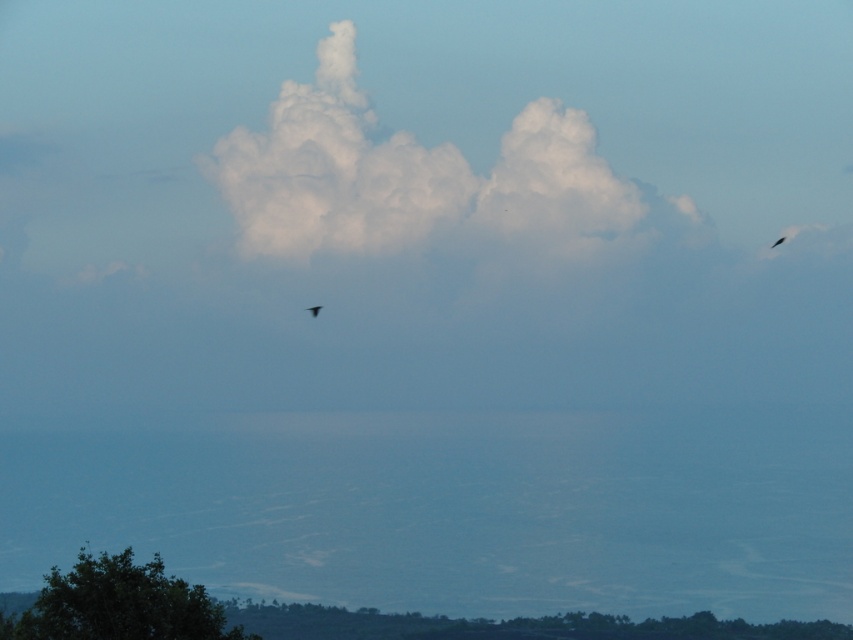
Question: Which object is the farthest from the black feathered bird at upper center?

Choices:
 (A) silvery metallic bird at center
 (B) white fluffy cloud at center

Answer: (A)

Question: Does white fluffy cloud at center come behind black feathered bird at upper center?

Choices:
 (A) yes
 (B) no

Answer: (B)

Question: Is green leafy tree at lower left bigger than silvery metallic bird at center?

Choices:
 (A) yes
 (B) no

Answer: (A)

Question: Among these points, which one is nearest to the camera?

Choices:
 (A) (316, 307)
 (B) (664, 216)

Answer: (A)

Question: Does green leafy tree at lower left have a larger size compared to silvery metallic bird at center?

Choices:
 (A) no
 (B) yes

Answer: (B)

Question: Estimate the real-world distances between objects in this image. Which object is farther from the green leafy tree at lower left?

Choices:
 (A) black feathered bird at upper center
 (B) white fluffy cloud at center
 (C) silvery metallic bird at center

Answer: (A)